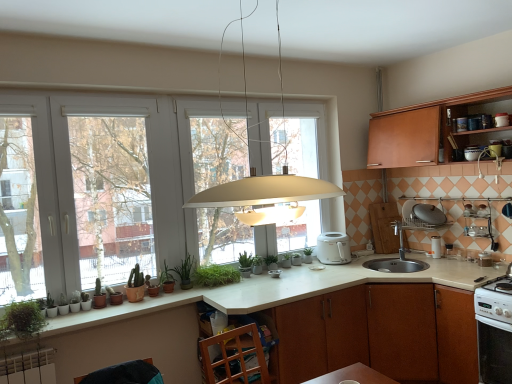
Find the location of a particular element. This screenshot has width=512, height=384. space that is in front of matte brown pot at lower left, which is counted as the fifth plant, starting from the back is located at coordinates (64, 311).